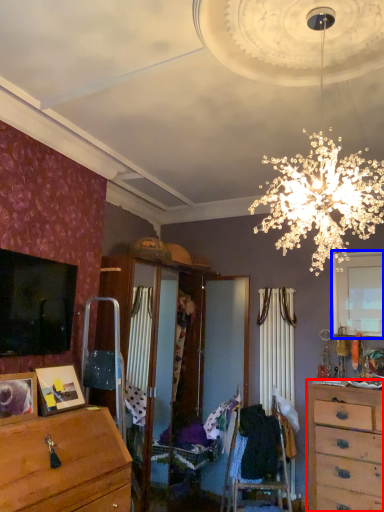
Question: Which of the following is the closest to the observer, chest of drawers (highlighted by a red box) or window (highlighted by a blue box)?

Choices:
 (A) chest of drawers
 (B) window

Answer: (A)